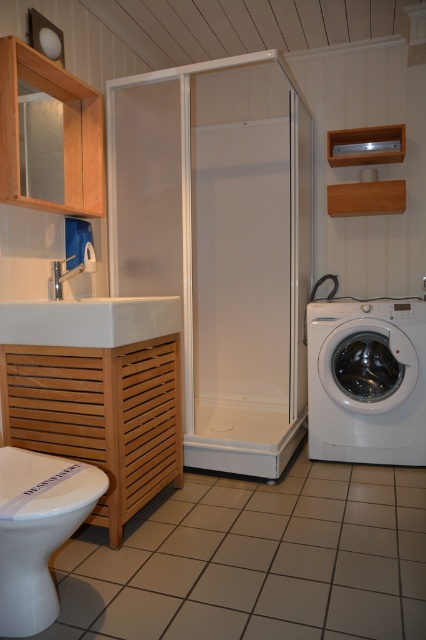
Question: Considering the real-world distances, which object is farthest from the white glossy toilet bowl at lower left?

Choices:
 (A) transparent glass shower door at center
 (B) white glossy sink at left

Answer: (A)

Question: Can you confirm if transparent glass shower door at center is smaller than white glossy toilet bowl at lower left?

Choices:
 (A) no
 (B) yes

Answer: (A)

Question: Can you confirm if transparent glass shower door at center is smaller than white glossy washing machine at lower right?

Choices:
 (A) no
 (B) yes

Answer: (A)

Question: Considering the real-world distances, which object is closest to the transparent glass shower door at center?

Choices:
 (A) white glossy toilet bowl at lower left
 (B) white glossy sink at left
 (C) white glossy washing machine at lower right

Answer: (C)

Question: Which point is closer to the camera?

Choices:
 (A) (37, 518)
 (B) (389, 340)
 (C) (212, 394)

Answer: (A)

Question: Is white glossy washing machine at lower right above white glossy toilet bowl at lower left?

Choices:
 (A) no
 (B) yes

Answer: (B)